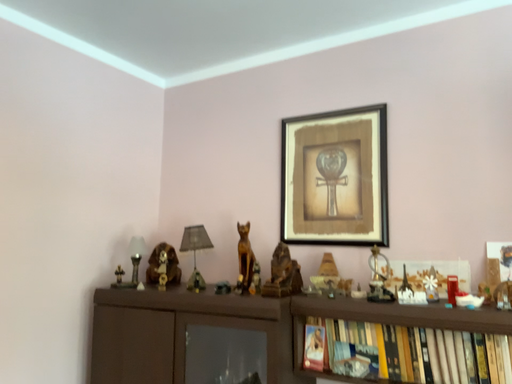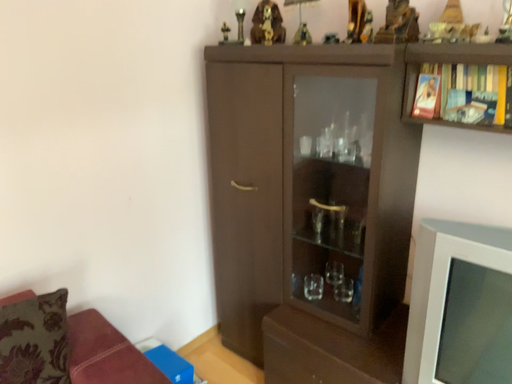
Question: How did the camera likely rotate when shooting the video?

Choices:
 (A) rotated upward
 (B) rotated downward

Answer: (B)